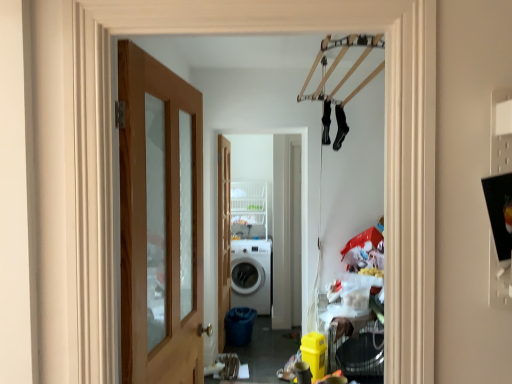
Question: From the image's perspective, is white matte washing machine at center positioned above or below wooden door at left, which is counted as the first door, starting from the front?

Choices:
 (A) below
 (B) above

Answer: (A)

Question: Is white matte washing machine at center taller or shorter than wooden door at left, which is counted as the first door, starting from the front?

Choices:
 (A) tall
 (B) short

Answer: (B)

Question: Which is farther from the white glossy washing machine at center?

Choices:
 (A) wooden door at left, marked as the 2th door in a back-to-front arrangement
 (B) wooden door at center, arranged as the 1th door when viewed from the back
 (C) white wire shelf at center
 (D) white matte washing machine at center

Answer: (A)

Question: Considering the real-world distances, which object is closest to the wooden door at left, marked as the 2th door in a back-to-front arrangement?

Choices:
 (A) white wire shelf at center
 (B) white glossy washing machine at center
 (C) wooden door at center, arranged as the 1th door when viewed from the back
 (D) white matte washing machine at center

Answer: (C)